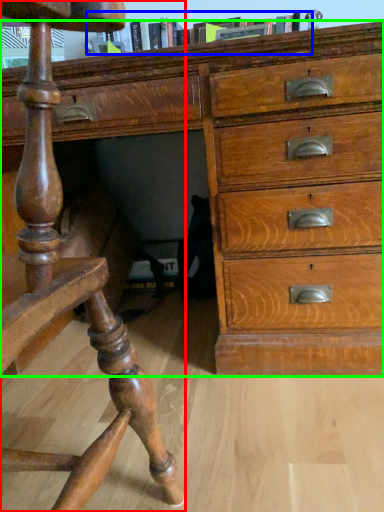
Question: Estimate the real-world distances between objects in this image. Which object is farther from furniture (highlighted by a red box), book (highlighted by a blue box) or chest of drawers (highlighted by a green box)?

Choices:
 (A) book
 (B) chest of drawers

Answer: (A)